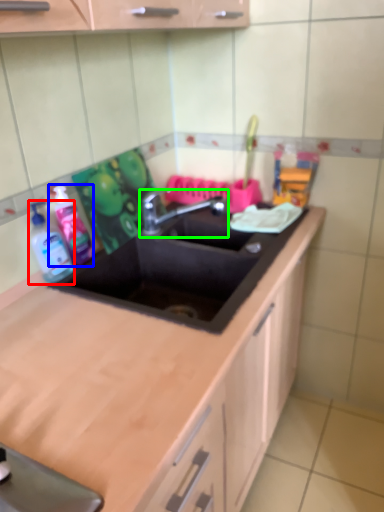
Question: Based on their relative distances, which object is nearer to bottle (highlighted by a red box)? Choose from cleaning product (highlighted by a blue box) and tap (highlighted by a green box).

Choices:
 (A) cleaning product
 (B) tap

Answer: (A)